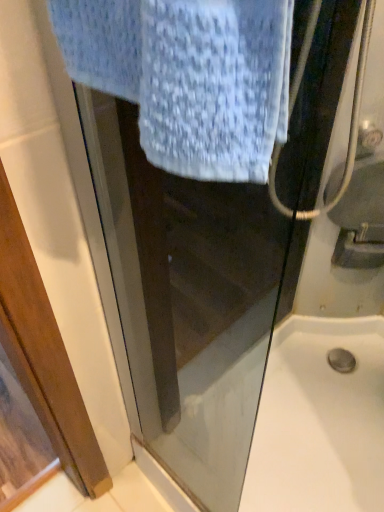
Locate an element on the screen. matte gray sink at right is located at coordinates (361, 217).

Describe the element at coordinates (361, 217) in the screenshot. I see `matte gray sink at right` at that location.

The width and height of the screenshot is (384, 512). What are the coordinates of `matte gray sink at right` in the screenshot? It's located at click(x=361, y=217).